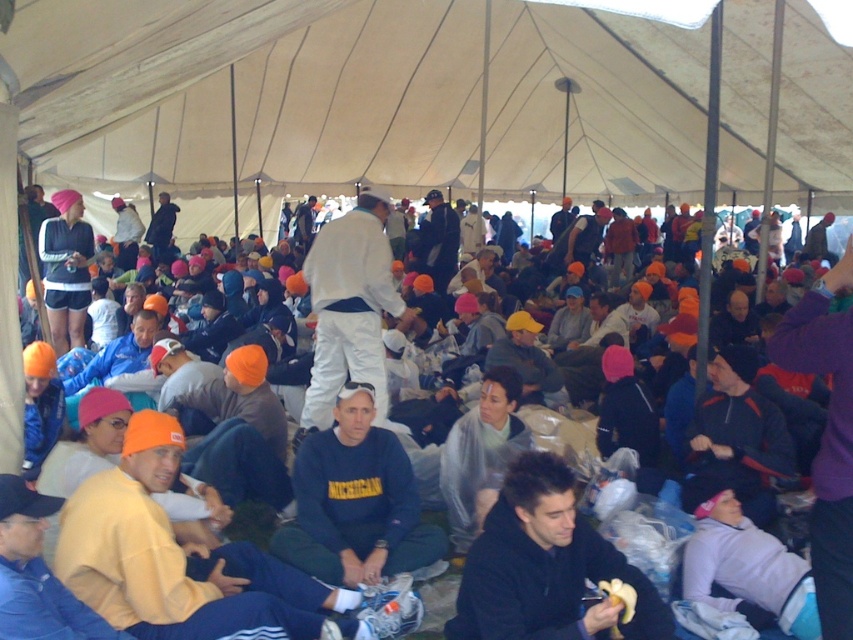
Which is more to the left, orange knit cap at center or black fleece jacket at center?

From the viewer's perspective, black fleece jacket at center appears more on the left side.

Identify the location of orange knit cap at center. Image resolution: width=853 pixels, height=640 pixels. (798, 368).

Between point (746, 326) and point (550, 628), which one is positioned in front?

Positioned in front is point (550, 628).

I want to click on orange knit cap at center, so click(798, 368).

Who is taller, black fleece jacket at center or dark blue fleece at center?

dark blue fleece at center

Which is below, black fleece jacket at center or dark blue fleece at center?

black fleece jacket at center is lower down.

Is point (509, 636) positioned before point (341, 470)?

Yes, point (509, 636) is closer to viewer.

The image size is (853, 640). Identify the location of black fleece jacket at center. (544, 566).

Can you confirm if orange knit cap at center is taller than dark blue fleece at center?

Correct, orange knit cap at center is much taller as dark blue fleece at center.

Can you confirm if orange knit cap at center is bigger than dark blue fleece at center?

Correct, orange knit cap at center is larger in size than dark blue fleece at center.

At what (x,y) coordinates should I click in order to perform the action: click on orange knit cap at center. Please return your answer as a coordinate pair (x, y). The image size is (853, 640). Looking at the image, I should click on (798, 368).